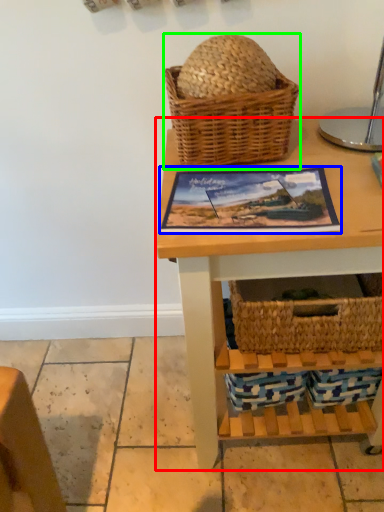
Question: Which is farther away from table (highlighted by a red box)? picture frame (highlighted by a blue box) or picnic basket (highlighted by a green box)?

Choices:
 (A) picture frame
 (B) picnic basket

Answer: (B)